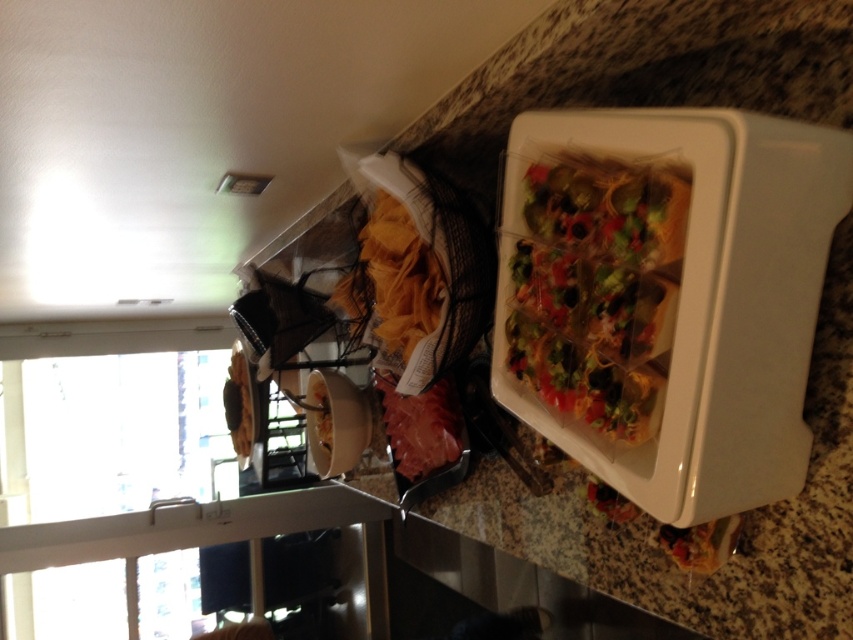
You are a chef preparing a meal and need to place both the translucent plastic containers at upper right and the white matte bowl at center on a shelf. If the shelf has limited depth, which item should you place closer to the front of the shelf to ensure both can fit?

The translucent plastic containers at upper right should be placed closer to the front of the shelf because they are in front of the white matte bowl at center, indicating they require less depth to accommodate their position.

You are a delivery person who needs to place a package that is 6 feet long on the countertop. The package must be placed between the translucent plastic containers at upper right and the white matte bowl at center. Is there enough space for the package?

The distance between the translucent plastic containers at upper right and the white matte bowl at center is 7.19 feet. Since the package is 6 feet long, there is enough space to place it between them.

You are preparing to pack a lunch and have both the translucent plastic containers at upper right and the white matte bowl at center available. Which container would allow you to fit more food due to its size?

The white matte bowl at center has a greater width than the translucent plastic containers at upper right, so it can hold more food.